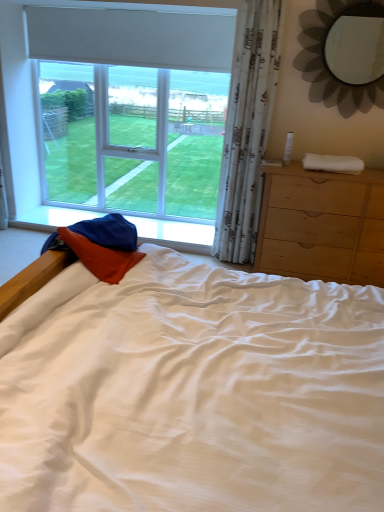
Question: From a real-world perspective, is white soft towel at right positioned over metallic flower-shaped mirror at upper right based on gravity?

Choices:
 (A) no
 (B) yes

Answer: (A)

Question: From the image's perspective, is white soft towel at right located beneath metallic flower-shaped mirror at upper right?

Choices:
 (A) no
 (B) yes

Answer: (B)

Question: Considering the relative positions of white soft towel at right and metallic flower-shaped mirror at upper right in the image provided, is white soft towel at right to the left of metallic flower-shaped mirror at upper right from the viewer's perspective?

Choices:
 (A) yes
 (B) no

Answer: (A)

Question: Can we say white soft towel at right lies outside metallic flower-shaped mirror at upper right?

Choices:
 (A) no
 (B) yes

Answer: (B)

Question: Is white soft towel at right smaller than metallic flower-shaped mirror at upper right?

Choices:
 (A) yes
 (B) no

Answer: (A)

Question: From the image's perspective, is white soft towel at right above metallic flower-shaped mirror at upper right?

Choices:
 (A) yes
 (B) no

Answer: (B)

Question: Is metallic flower-shaped mirror at upper right to the left of white soft towel at right from the viewer's perspective?

Choices:
 (A) no
 (B) yes

Answer: (A)

Question: From the image's perspective, is metallic flower-shaped mirror at upper right over white soft towel at right?

Choices:
 (A) no
 (B) yes

Answer: (B)

Question: Does metallic flower-shaped mirror at upper right contain white soft towel at right?

Choices:
 (A) yes
 (B) no

Answer: (B)

Question: From the image's perspective, does metallic flower-shaped mirror at upper right appear lower than white soft towel at right?

Choices:
 (A) yes
 (B) no

Answer: (B)

Question: Does metallic flower-shaped mirror at upper right have a lesser width compared to white soft towel at right?

Choices:
 (A) no
 (B) yes

Answer: (B)

Question: Does metallic flower-shaped mirror at upper right lie behind white soft towel at right?

Choices:
 (A) yes
 (B) no

Answer: (B)

Question: Is white sheer curtain at right positioned beyond the bounds of light brown wooden chest of drawers at right?

Choices:
 (A) yes
 (B) no

Answer: (A)